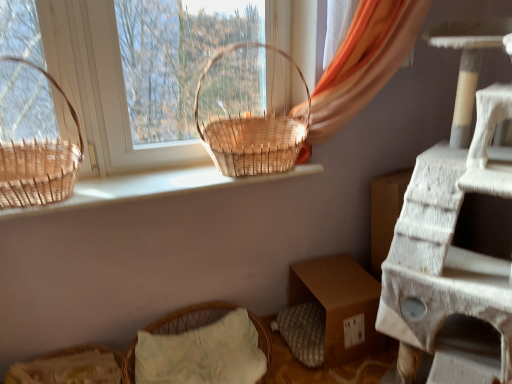
What do you see at coordinates (39, 163) in the screenshot?
I see `brown woven basket at left, the second picnic basket viewed from the right` at bounding box center [39, 163].

Where is `brown woven basket at left, the second picnic basket viewed from the right`? brown woven basket at left, the second picnic basket viewed from the right is located at coordinates (39, 163).

The image size is (512, 384). Describe the element at coordinates (366, 78) in the screenshot. I see `orange fabric curtain at upper right` at that location.

The image size is (512, 384). Identify the location of woven straw basket at lower left. (71, 367).

From a real-world perspective, which object stands above the other?

orange fabric curtain at upper right.

From the image's perspective, is natural wood basket at upper center beneath orange fabric curtain at upper right?

Yes.

Does point (246, 181) appear closer or farther from the camera than point (312, 104)?

Clearly, point (246, 181) is closer to the camera than point (312, 104).

Considering the relative sizes of natural wood basket at upper center and orange fabric curtain at upper right in the image provided, is natural wood basket at upper center thinner than orange fabric curtain at upper right?

Yes, natural wood basket at upper center is thinner than orange fabric curtain at upper right.

Considering the sizes of objects woven straw basket at lower left and natural wood basket at upper center in the image provided, who is bigger, woven straw basket at lower left or natural wood basket at upper center?

With larger size is woven straw basket at lower left.

Looking at their sizes, would you say woven straw basket at lower left is wider or thinner than natural wood basket at upper center?

Clearly, woven straw basket at lower left has more width compared to natural wood basket at upper center.

Between woven straw basket at lower left and natural wood basket at upper center, which one appears on the left side from the viewer's perspective?

From the viewer's perspective, woven straw basket at lower left appears more on the left side.

Between woven natural basket at center, placed as the second picnic basket when sorted from left to right, and brown woven basket at left, which is counted as the first picnic basket, starting from the left, which one has less height?

With less height is brown woven basket at left, which is counted as the first picnic basket, starting from the left.

Is woven natural basket at center, placed as the second picnic basket when sorted from left to right, turned away from brown woven basket at left, the second picnic basket viewed from the right?

No, brown woven basket at left, the second picnic basket viewed from the right, is not at the back of woven natural basket at center, placed as the second picnic basket when sorted from left to right.

From the picture: From a real-world perspective, is woven natural basket at center, which appears as the 1th picnic basket when viewed from the right, below brown woven basket at left, the second picnic basket viewed from the right?

No.

Does point (280, 147) come behind point (11, 173)?

Yes, it is behind point (11, 173).

Considering the relative sizes of woven straw basket at lower left and light green fabric pillow at lower center in the image provided, is woven straw basket at lower left taller than light green fabric pillow at lower center?

Incorrect, the height of woven straw basket at lower left is not larger of that of light green fabric pillow at lower center.

Based on the photo, from a real-world perspective, is woven straw basket at lower left positioned under light green fabric pillow at lower center based on gravity?

Yes.

Which of these two, woven straw basket at lower left or light green fabric pillow at lower center, is smaller?

Smaller between the two is woven straw basket at lower left.

Based on the photo, measure the distance between woven natural basket at center, which appears as the 1th picnic basket when viewed from the right, and natural wood basket at upper center.

woven natural basket at center, which appears as the 1th picnic basket when viewed from the right, and natural wood basket at upper center are 25.87 centimeters apart from each other.

You are a GUI agent. You are given a task and a screenshot of the screen. Output one action in this format:
    pyautogui.click(x=<x>, y=<y>)
    Task: Click on the window sill in front of the woven natural basket at center, placed as the second picnic basket when sorted from left to right
    The image size is (512, 384).
    Given the screenshot: What is the action you would take?
    pyautogui.click(x=151, y=187)

Is woven natural basket at center, placed as the second picnic basket when sorted from left to right, shorter than natural wood basket at upper center?

In fact, woven natural basket at center, placed as the second picnic basket when sorted from left to right, may be taller than natural wood basket at upper center.

Can you tell me how much woven natural basket at center, which appears as the 1th picnic basket when viewed from the right, and natural wood basket at upper center differ in facing direction?

The angular difference between woven natural basket at center, which appears as the 1th picnic basket when viewed from the right, and natural wood basket at upper center is 0.000169 degrees.

From a real-world perspective, is woven natural basket at center, which appears as the 1th picnic basket when viewed from the right, below woven straw basket at lower left?

No, from a real-world perspective, woven natural basket at center, which appears as the 1th picnic basket when viewed from the right, is not below woven straw basket at lower left.

Which is behind, woven natural basket at center, which appears as the 1th picnic basket when viewed from the right, or woven straw basket at lower left?

woven natural basket at center, which appears as the 1th picnic basket when viewed from the right, is further from the camera.

From their relative heights in the image, would you say woven natural basket at center, placed as the second picnic basket when sorted from left to right, is taller or shorter than woven straw basket at lower left?

woven natural basket at center, placed as the second picnic basket when sorted from left to right, is taller than woven straw basket at lower left.

Is woven straw basket at lower left at the back of woven natural basket at center, placed as the second picnic basket when sorted from left to right?

No.

Find the location of a particular element. This screenshot has height=384, width=512. curtain lying behind the light green fabric pillow at lower center is located at coordinates (366, 78).

From a real-world perspective, is orange fabric curtain at upper right above or below light green fabric pillow at lower center?

Clearly, from a real-world perspective, orange fabric curtain at upper right is above light green fabric pillow at lower center.

Does orange fabric curtain at upper right appear on the right side of light green fabric pillow at lower center?

Yes.

How different are the orientations of orange fabric curtain at upper right and light green fabric pillow at lower center in degrees?

The angular difference between orange fabric curtain at upper right and light green fabric pillow at lower center is 0.108 degrees.

This screenshot has height=384, width=512. Find the location of `curtain above the natural wood basket at upper center (from the image's perspective)`. curtain above the natural wood basket at upper center (from the image's perspective) is located at coordinates (366, 78).

Where is `flower basket on the left of natural wood basket at upper center`? flower basket on the left of natural wood basket at upper center is located at coordinates (71, 367).

Based on their spatial positions, is natural wood basket at upper center or woven natural basket at center, placed as the second picnic basket when sorted from left to right, further from light green fabric pillow at lower center?

woven natural basket at center, placed as the second picnic basket when sorted from left to right.

From the image, which object appears to be farther from brown woven basket at left, the second picnic basket viewed from the right, orange fabric curtain at upper right or natural wood basket at upper center?

orange fabric curtain at upper right lies further to brown woven basket at left, the second picnic basket viewed from the right, than the other object.

Looking at the image, which one is located closer to orange fabric curtain at upper right, natural wood basket at upper center or brown woven basket at left, the second picnic basket viewed from the right?

The object closer to orange fabric curtain at upper right is natural wood basket at upper center.

Based on their spatial positions, is orange fabric curtain at upper right or woven natural basket at center, which appears as the 1th picnic basket when viewed from the right, closer to natural wood basket at upper center?

Based on the image, woven natural basket at center, which appears as the 1th picnic basket when viewed from the right, appears to be nearer to natural wood basket at upper center.

From the picture: From the image, which object appears to be nearer to woven natural basket at center, placed as the second picnic basket when sorted from left to right, orange fabric curtain at upper right or natural wood basket at upper center?

natural wood basket at upper center lies closer to woven natural basket at center, placed as the second picnic basket when sorted from left to right, than the other object.

Estimate the real-world distances between objects in this image. Which object is closer to light green fabric pillow at lower center, woven natural basket at center, placed as the second picnic basket when sorted from left to right, or orange fabric curtain at upper right?

The object closer to light green fabric pillow at lower center is woven natural basket at center, placed as the second picnic basket when sorted from left to right.

Based on their spatial positions, is brown woven basket at left, which is counted as the first picnic basket, starting from the left, or natural wood basket at upper center further from woven natural basket at center, placed as the second picnic basket when sorted from left to right?

brown woven basket at left, which is counted as the first picnic basket, starting from the left.

Based on their spatial positions, is woven straw basket at lower left or natural wood basket at upper center further from brown woven basket at left, which is counted as the first picnic basket, starting from the left?

The object further to brown woven basket at left, which is counted as the first picnic basket, starting from the left, is woven straw basket at lower left.

Locate an element on the screen. picnic basket between brown woven basket at left, the second picnic basket viewed from the right, and orange fabric curtain at upper right from left to right is located at coordinates (246, 118).

You are a GUI agent. You are given a task and a screenshot of the screen. Output one action in this format:
    pyautogui.click(x=<x>, y=<y>)
    Task: Click on the pillow between brown woven basket at left, the second picnic basket viewed from the right, and woven straw basket at lower left, in the vertical direction
    The image size is (512, 384).
    Given the screenshot: What is the action you would take?
    pyautogui.click(x=202, y=348)

Find the location of a particular element. picnic basket between woven natural basket at center, which appears as the 1th picnic basket when viewed from the right, and light green fabric pillow at lower center from top to bottom is located at coordinates click(x=39, y=163).

Locate an element on the screen. picnic basket between woven natural basket at center, placed as the second picnic basket when sorted from left to right, and woven straw basket at lower left from top to bottom is located at coordinates (39, 163).